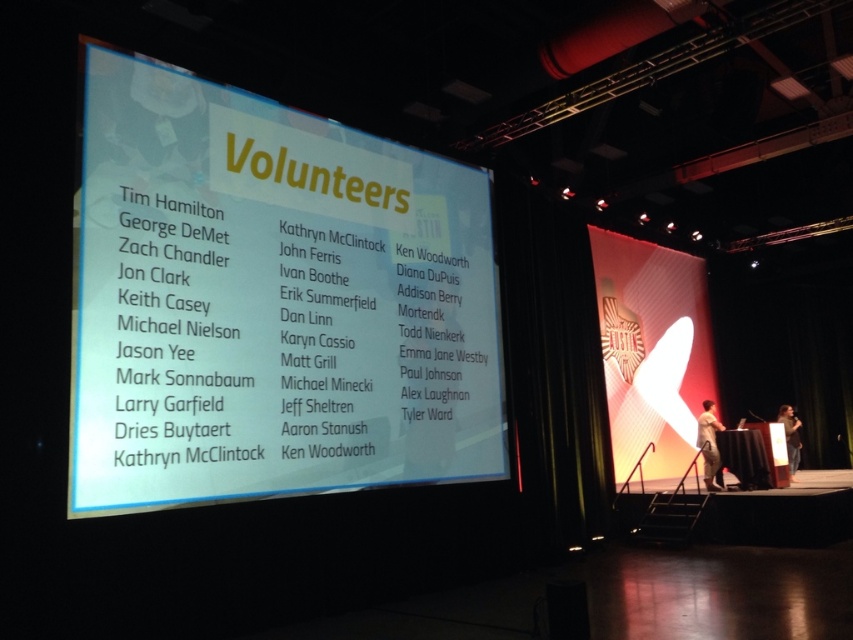
Identify the location of white fabric at center. This screenshot has height=640, width=853. (709, 444).

Which is behind, point (720, 424) or point (795, 458)?

Positioned behind is point (795, 458).

Locate an element on the screen. Image resolution: width=853 pixels, height=640 pixels. white fabric at center is located at coordinates (709, 444).

Which is more to the left, white glossy screen at center or light brown fabric shirt at center?

white glossy screen at center is more to the left.

Who is more forward, (x=631, y=320) or (x=792, y=436)?

Point (x=631, y=320) is more forward.

Is point (701, 388) positioned in front of point (788, 413)?

No, it is behind (788, 413).

Where is `white glossy screen at center`? white glossy screen at center is located at coordinates (651, 349).

Is white paper at center bigger than white glossy screen at center?

Indeed, white paper at center has a larger size compared to white glossy screen at center.

Who is taller, white paper at center or white glossy screen at center?

white glossy screen at center

Find the location of `white paper at center`. white paper at center is located at coordinates (270, 301).